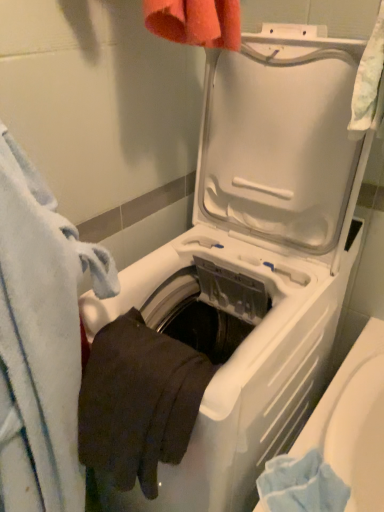
Describe the element at coordinates (137, 401) in the screenshot. I see `dark cotton bath towel at lower left` at that location.

Locate an element on the screen. dark cotton bath towel at lower left is located at coordinates (137, 401).

Describe the element at coordinates (41, 340) in the screenshot. The width and height of the screenshot is (384, 512). I see `blue soft towel at left` at that location.

Measure the distance between point (42,238) and camera.

Point (42,238) is 23.86 inches away from camera.

Find the location of a particular element. The width and height of the screenshot is (384, 512). blue soft towel at left is located at coordinates (41, 340).

The height and width of the screenshot is (512, 384). I want to click on dark cotton bath towel at lower left, so click(137, 401).

Which object is positioned more to the left, blue soft towel at left or dark cotton bath towel at lower left?

blue soft towel at left is more to the left.

Considering their positions, is blue soft towel at left located in front of or behind dark cotton bath towel at lower left?

Clearly, blue soft towel at left is in front of dark cotton bath towel at lower left.

Which is closer, (114,273) or (121,358)?

The point (114,273) is closer to the camera.

From the image's perspective, which is below, blue soft towel at left or dark cotton bath towel at lower left?

From the image's view, blue soft towel at left is below.

From a real-world perspective, is blue soft towel at left beneath dark cotton bath towel at lower left?

Yes, from a real-world perspective, blue soft towel at left is below dark cotton bath towel at lower left.

Based on the photo, between blue soft towel at left and dark cotton bath towel at lower left, which one has smaller width?

With smaller width is dark cotton bath towel at lower left.

Looking at this image, between blue soft towel at left and dark cotton bath towel at lower left, which one has less height?

dark cotton bath towel at lower left is shorter.

Considering the sizes of blue soft towel at left and dark cotton bath towel at lower left in the image, is blue soft towel at left bigger or smaller than dark cotton bath towel at lower left?

In the image, blue soft towel at left appears to be larger than dark cotton bath towel at lower left.

Could dark cotton bath towel at lower left be considered to be inside blue soft towel at left?

No, blue soft towel at left does not contain dark cotton bath towel at lower left.

Is blue soft towel at left not close to dark cotton bath towel at lower left?

No, blue soft towel at left is in close proximity to dark cotton bath towel at lower left.

Does blue soft towel at left turn towards dark cotton bath towel at lower left?

No, blue soft towel at left is not turned towards dark cotton bath towel at lower left.

How distant is blue soft towel at left from dark cotton bath towel at lower left?

blue soft towel at left is 4.51 inches away from dark cotton bath towel at lower left.

The height and width of the screenshot is (512, 384). Find the location of `towel in front of the dark cotton bath towel at lower left`. towel in front of the dark cotton bath towel at lower left is located at coordinates (41, 340).

In the image, is dark cotton bath towel at lower left on the left side or the right side of blue soft towel at left?

dark cotton bath towel at lower left is positioned on blue soft towel at left's right side.

Considering the relative positions of dark cotton bath towel at lower left and blue soft towel at left in the image provided, is dark cotton bath towel at lower left behind blue soft towel at left?

Yes, it is behind blue soft towel at left.

Is point (146, 383) positioned after point (39, 416)?

No.

From the image's perspective, relative to blue soft towel at left, is dark cotton bath towel at lower left above or below?

From the image's perspective, dark cotton bath towel at lower left appears above blue soft towel at left.

In the scene shown: From a real-world perspective, is dark cotton bath towel at lower left physically located above or below blue soft towel at left?

In terms of real-world spatial position, dark cotton bath towel at lower left is above blue soft towel at left.

Between dark cotton bath towel at lower left and blue soft towel at left, which one has smaller width?

dark cotton bath towel at lower left is thinner.

Considering the sizes of objects dark cotton bath towel at lower left and blue soft towel at left in the image provided, who is shorter, dark cotton bath towel at lower left or blue soft towel at left?

Standing shorter between the two is dark cotton bath towel at lower left.

Which of these two, dark cotton bath towel at lower left or blue soft towel at left, is bigger?

blue soft towel at left.

Is dark cotton bath towel at lower left located outside blue soft towel at left?

Indeed, dark cotton bath towel at lower left is completely outside blue soft towel at left.

Is dark cotton bath towel at lower left positioned far away from blue soft towel at left?

No.

Is dark cotton bath towel at lower left facing away from blue soft towel at left?

dark cotton bath towel at lower left is not turned away from blue soft towel at left.

Locate an element on the screen. This screenshot has height=512, width=384. towel on the left of dark cotton bath towel at lower left is located at coordinates (41, 340).

Where is `towel below the dark cotton bath towel at lower left (from the image's perspective)`? towel below the dark cotton bath towel at lower left (from the image's perspective) is located at coordinates (41, 340).

Find the location of a particular element. towel on the left of dark cotton bath towel at lower left is located at coordinates pos(41,340).